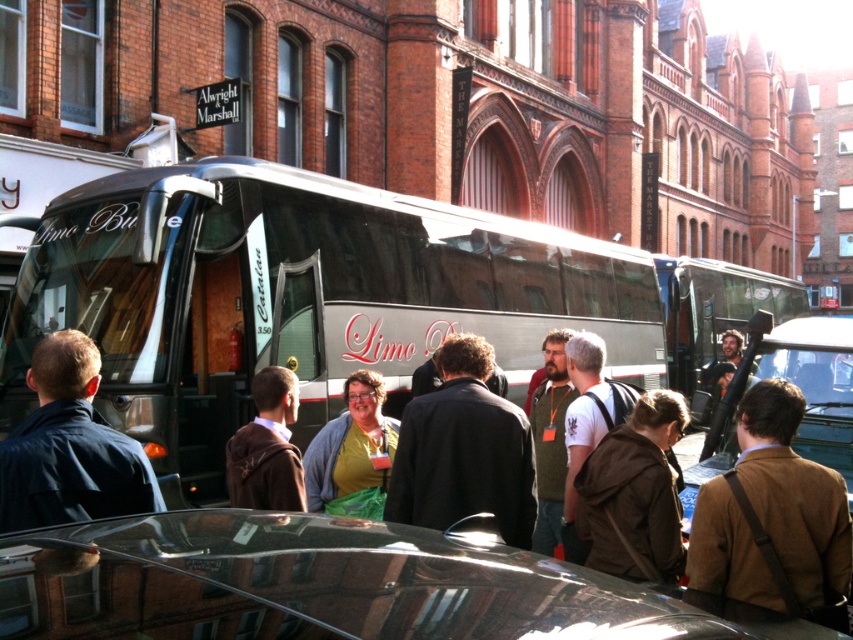
You are a photographer trying to capture a photo of the metallic silver bus at center without including the dark blue jacket at left in the frame. Given their relative sizes, is this possible?

The dark blue jacket at left is shorter than the metallic silver bus at center, so it is possible to capture the metallic silver bus at center without including the dark blue jacket at left in the frame by adjusting the camera angle to focus on the taller bus.

You are a photographer standing at the camera position. You want to take a photo of the brown wool jacket at center. What are the coordinates of the jacket in the image?

The coordinates of the brown wool jacket at center are at point (x=773, y=518).